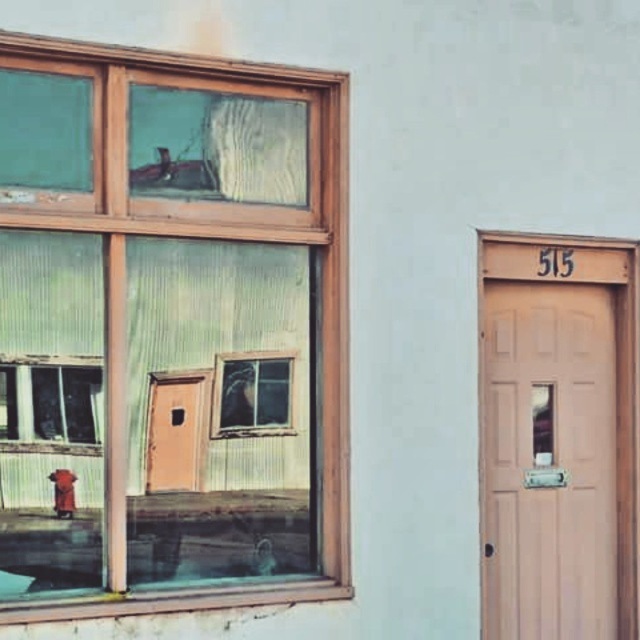
Consider the image. Does clear glass window at upper left appear under brass metallic hydrant at lower left?

No.

Between clear glass window at upper left and brass metallic hydrant at lower left, which one appears on the left side from the viewer's perspective?

→ brass metallic hydrant at lower left

Who is more distant from viewer, [291,113] or [60,492]?

Point [291,113]

The height and width of the screenshot is (640, 640). In order to click on clear glass window at upper left in this screenshot , I will do `click(170, 330)`.

Who is more distant from viewer, (323, 449) or (586, 346)?

Point (586, 346)

Which of these two, clear glass window at upper left or matte wood door at right, stands taller?

clear glass window at upper left

Between point (19, 605) and point (557, 301), which one is positioned behind?

Point (557, 301)

Locate an element on the screen. The height and width of the screenshot is (640, 640). clear glass window at upper left is located at coordinates (170, 330).

Which of these two, matte wood door at right or brass metallic hydrant at lower left, stands shorter?

brass metallic hydrant at lower left is shorter.

Does point (529, 380) lie behind point (64, 472)?

Yes, point (529, 380) is farther from viewer.

At what (x,y) coordinates should I click in order to perform the action: click on matte wood door at right. Please return your answer as a coordinate pair (x, y). This screenshot has height=640, width=640. Looking at the image, I should click on (548, 461).